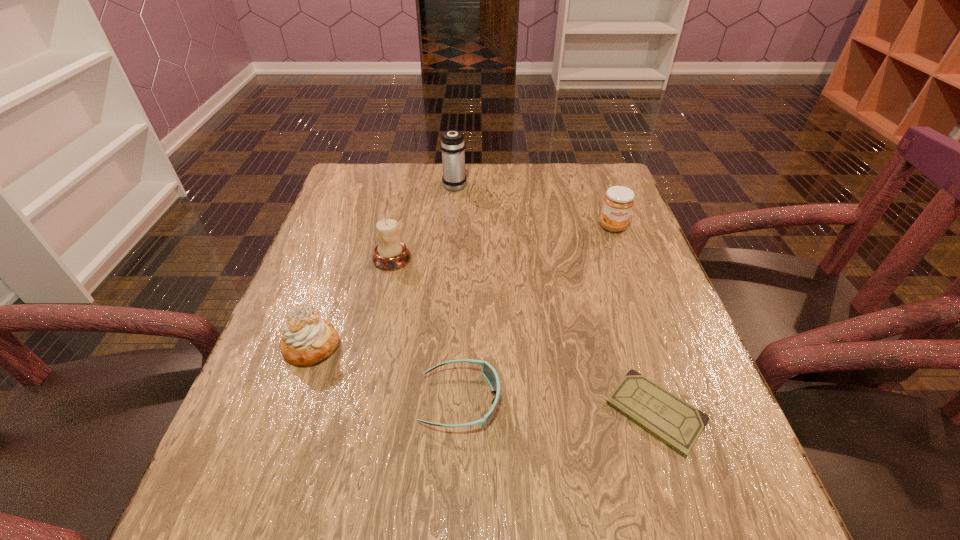
You are a GUI agent. You are given a task and a screenshot of the screen. Output one action in this format:
    pyautogui.click(x=<x>, y=<y>)
    Task: Click on the empty space that is in between the farthest object and the goggles
    This screenshot has height=540, width=960.
    Given the screenshot: What is the action you would take?
    pyautogui.click(x=458, y=293)

What are the coordinates of `free point between the third farthest object and the fourth farthest object` in the screenshot? It's located at (351, 302).

This screenshot has width=960, height=540. What are the coordinates of `empty location between the fifth nearest object and the farthest object` in the screenshot? It's located at (534, 206).

Image resolution: width=960 pixels, height=540 pixels. I want to click on unoccupied position between the pastry and the fifth object from right to left, so click(x=351, y=302).

Image resolution: width=960 pixels, height=540 pixels. Identify the location of the fourth closest object to the leftmost object. (452, 144).

At what (x,y) coordinates should I click in order to perform the action: click on object that is the third closest one to the fifth nearest object. Please return your answer as a coordinate pair (x, y). Looking at the image, I should click on (390, 254).

Identify the location of free spot that satisfies the following two spatial constraints: 1. on the front-facing side of the checkbook; 2. on the left side of the goggles. The height and width of the screenshot is (540, 960). (460, 413).

Find the location of a particular element. This screenshot has height=540, width=960. blank area in the image that satisfies the following two spatial constraints: 1. on the front label of the second farthest object; 2. on the front-facing side of the goggles is located at coordinates (677, 401).

This screenshot has height=540, width=960. What are the coordinates of `free location that satisfies the following two spatial constraints: 1. on the front-facing side of the goggles; 2. on the left side of the shortest object` in the screenshot? It's located at (460, 413).